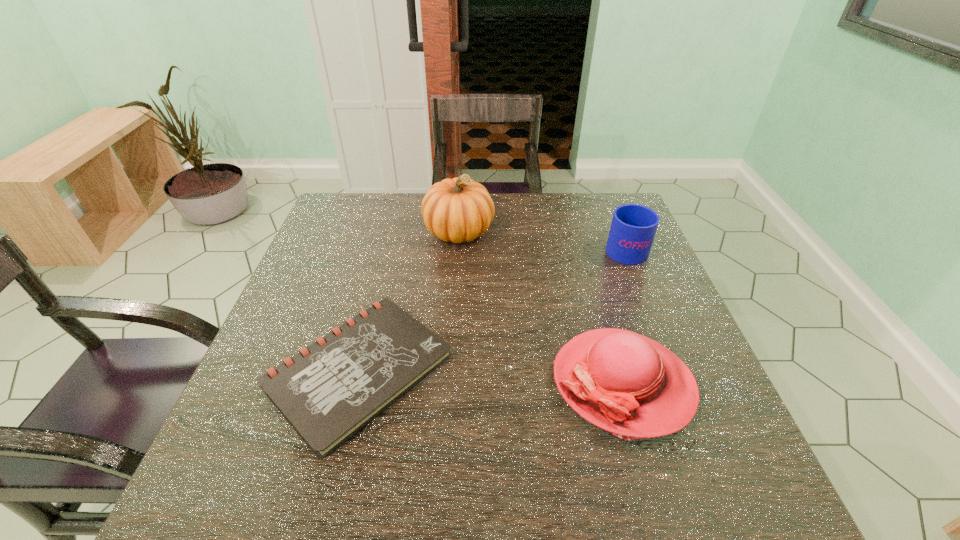
The height and width of the screenshot is (540, 960). I want to click on blank space located 0.380m at the front of the hat with a bow, so click(364, 383).

Where is `free space located on the back of the shortest object`? free space located on the back of the shortest object is located at coordinates (397, 219).

Where is `pumpkin that is positioned at the far edge`? pumpkin that is positioned at the far edge is located at coordinates (459, 209).

You are a GUI agent. You are given a task and a screenshot of the screen. Output one action in this format:
    pyautogui.click(x=<x>, y=<y>)
    Task: Click on the mug positioned at the far edge
    
    Given the screenshot: What is the action you would take?
    pyautogui.click(x=633, y=228)

I want to click on object at the left edge, so click(x=328, y=391).

This screenshot has height=540, width=960. Find the location of `mug that is at the right edge`. mug that is at the right edge is located at coordinates coord(633,228).

Where is `hat located in the right edge section of the desktop`? hat located in the right edge section of the desktop is located at coordinates (622, 382).

At what (x,y) coordinates should I click in order to perform the action: click on object that is at the far right corner. Please return your answer as a coordinate pair (x, y). Looking at the image, I should click on (633, 228).

Identify the location of vacant space at the far edge of the desktop. The width and height of the screenshot is (960, 540). (563, 197).

Where is `free region at the near edge of the desktop`? The image size is (960, 540). free region at the near edge of the desktop is located at coordinates (470, 488).